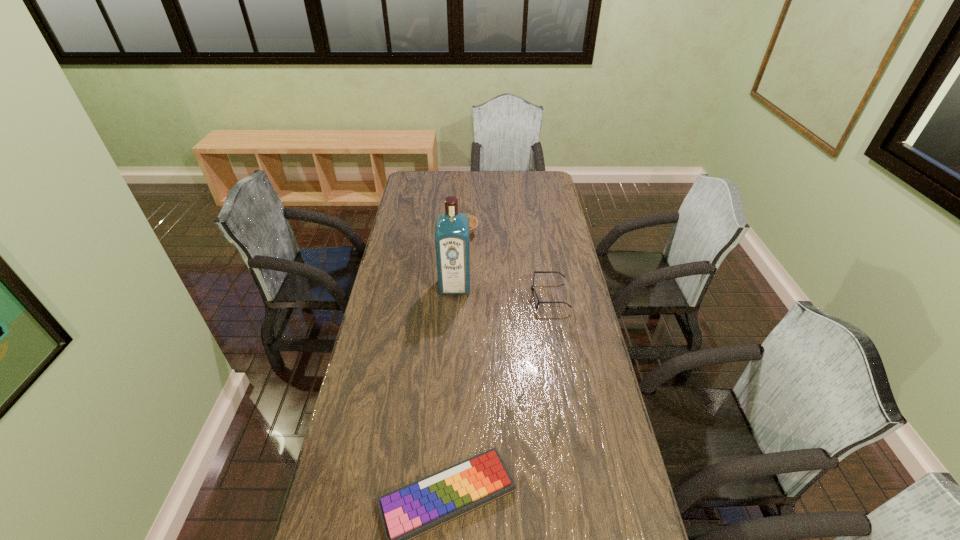
This screenshot has height=540, width=960. I want to click on free location at the left edge, so click(x=384, y=378).

Identify the location of vacant space at the right edge of the desktop. (591, 329).

Where is `free area in between the rightmost object and the bowl`? Image resolution: width=960 pixels, height=540 pixels. free area in between the rightmost object and the bowl is located at coordinates (506, 265).

Locate an element on the screen. free spot between the rightmost object and the bowl is located at coordinates (506, 265).

Locate an element on the screen. This screenshot has height=540, width=960. vacant space that's between the rightmost object and the bowl is located at coordinates (506, 265).

Image resolution: width=960 pixels, height=540 pixels. Find the location of `vacant area that lies between the spectacles and the liquor`. vacant area that lies between the spectacles and the liquor is located at coordinates (502, 291).

Identify the location of empty space between the rightmost object and the bowl. (506, 265).

The width and height of the screenshot is (960, 540). Find the location of `vacant space that is in between the rightmost object and the farthest object`. vacant space that is in between the rightmost object and the farthest object is located at coordinates (506, 265).

This screenshot has width=960, height=540. What are the coordinates of `the second closest object to the farthest object` in the screenshot? It's located at click(532, 287).

At what (x,y) coordinates should I click in order to perform the action: click on object that stands as the second closest to the bowl. Please return your answer as a coordinate pair (x, y). This screenshot has width=960, height=540. Looking at the image, I should click on tap(532, 287).